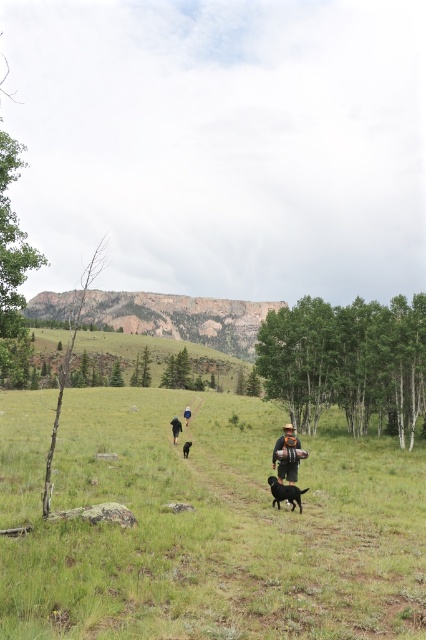
You are a hiker standing in the scene. You notice the green grassy field at center and the dark blue jeans at center. Which object is higher in height?

The green grassy field at center is taller than the dark blue jeans at center.

You are standing in the middle of the green grassy field at center and dark blue jeans at center. Which object is located to the right side from your perspective?

The green grassy field at center is to the right of dark blue jeans at center.

You are a hiker who wants to take a shortcut through the green grassy field at center and the black fur dog at center. Which path would you choose if you want to reach the mountains faster?

The green grassy field at center is in front of the black fur dog at center, so choosing the path through the green grassy field at center would allow you to reach the mountains faster since it is closer to your current position.